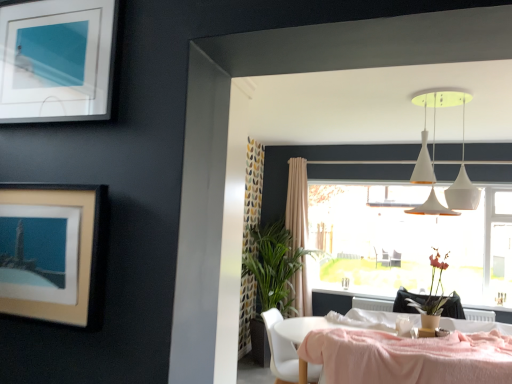
Question: Does beige matte picture frame at upper left, placed as the second picture frame when sorted from top to bottom, come behind transparent glass window at center?

Choices:
 (A) yes
 (B) no

Answer: (B)

Question: Is beige matte picture frame at upper left, the first picture frame in the bottom-to-top sequence, wider than transparent glass window at center?

Choices:
 (A) yes
 (B) no

Answer: (B)

Question: From a real-world perspective, is beige matte picture frame at upper left, placed as the second picture frame when sorted from top to bottom, on transparent glass window at center?

Choices:
 (A) yes
 (B) no

Answer: (B)

Question: Considering the relative positions of beige matte picture frame at upper left, the first picture frame in the bottom-to-top sequence, and transparent glass window at center in the image provided, is beige matte picture frame at upper left, the first picture frame in the bottom-to-top sequence, to the right of transparent glass window at center from the viewer's perspective?

Choices:
 (A) yes
 (B) no

Answer: (B)

Question: From a real-world perspective, is beige matte picture frame at upper left, the first picture frame in the bottom-to-top sequence, located beneath transparent glass window at center?

Choices:
 (A) yes
 (B) no

Answer: (A)

Question: Is beige fabric curtain at center wider or thinner than white matte pendant lights at upper center?

Choices:
 (A) thin
 (B) wide

Answer: (A)

Question: Is point click(x=297, y=271) closer or farther from the camera than point click(x=445, y=210)?

Choices:
 (A) closer
 (B) farther

Answer: (B)

Question: Considering their positions, is beige fabric curtain at center located in front of or behind white matte pendant lights at upper center?

Choices:
 (A) behind
 (B) front

Answer: (A)

Question: From the image's perspective, is beige fabric curtain at center positioned above or below white matte pendant lights at upper center?

Choices:
 (A) above
 (B) below

Answer: (B)

Question: Is transparent glass window at center to the left or to the right of beige fabric curtain at center in the image?

Choices:
 (A) left
 (B) right

Answer: (B)

Question: Is transparent glass window at center situated inside beige fabric curtain at center or outside?

Choices:
 (A) outside
 (B) inside

Answer: (A)

Question: Relative to beige fabric curtain at center, is transparent glass window at center in front or behind?

Choices:
 (A) behind
 (B) front

Answer: (B)

Question: Is transparent glass window at center wider or thinner than beige fabric curtain at center?

Choices:
 (A) thin
 (B) wide

Answer: (A)

Question: Relative to matte silver picture frame at upper left, the second picture frame from the bottom, is pink fabric-covered table at lower right in front or behind?

Choices:
 (A) front
 (B) behind

Answer: (B)

Question: Looking at the image, does pink fabric-covered table at lower right seem bigger or smaller compared to matte silver picture frame at upper left, which ranks as the 1th picture frame in top-to-bottom order?

Choices:
 (A) big
 (B) small

Answer: (A)